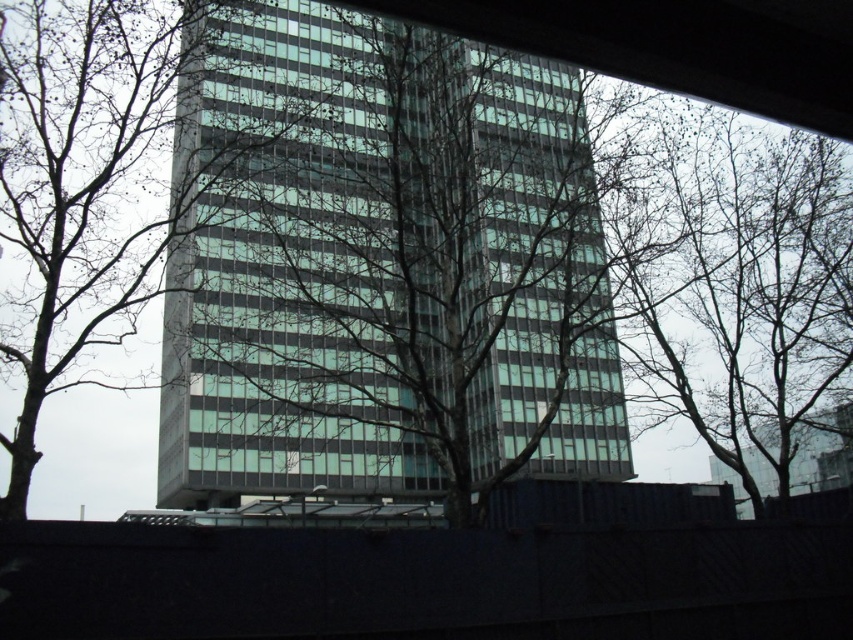
Question: Is green glass building at center closer to camera compared to bare branches at upper center?

Choices:
 (A) no
 (B) yes

Answer: (B)

Question: Is green glass building at center below bare branches at upper center?

Choices:
 (A) no
 (B) yes

Answer: (A)

Question: Which point is closer to the camera?

Choices:
 (A) green glass building at center
 (B) bare branches at upper center

Answer: (A)

Question: Can you confirm if green glass building at center is smaller than bare branches at upper center?

Choices:
 (A) no
 (B) yes

Answer: (A)

Question: Which point is farther to the camera?

Choices:
 (A) (786, 412)
 (B) (270, 435)

Answer: (B)